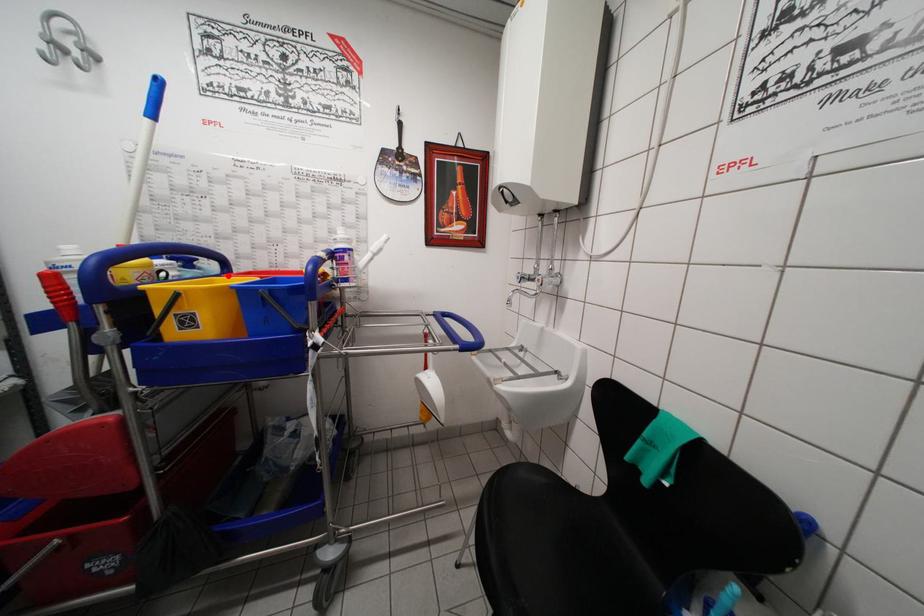
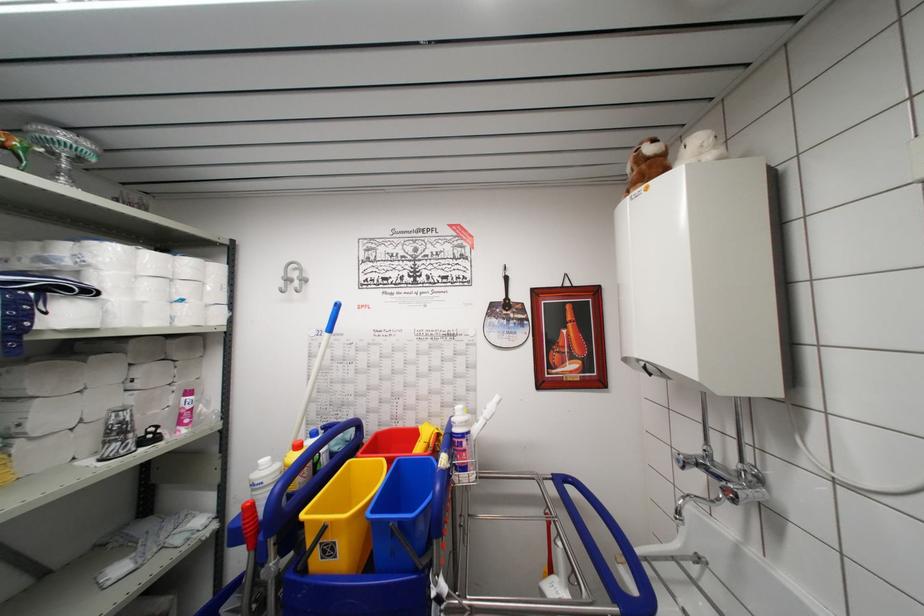
Where in the second image is the point corresponding to the highlighted location from the first image?

(361, 439)